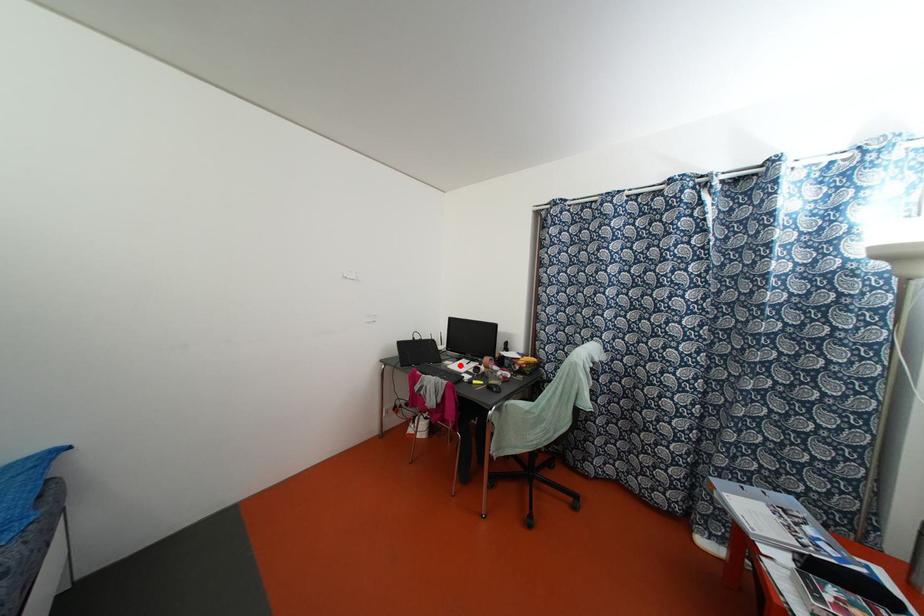
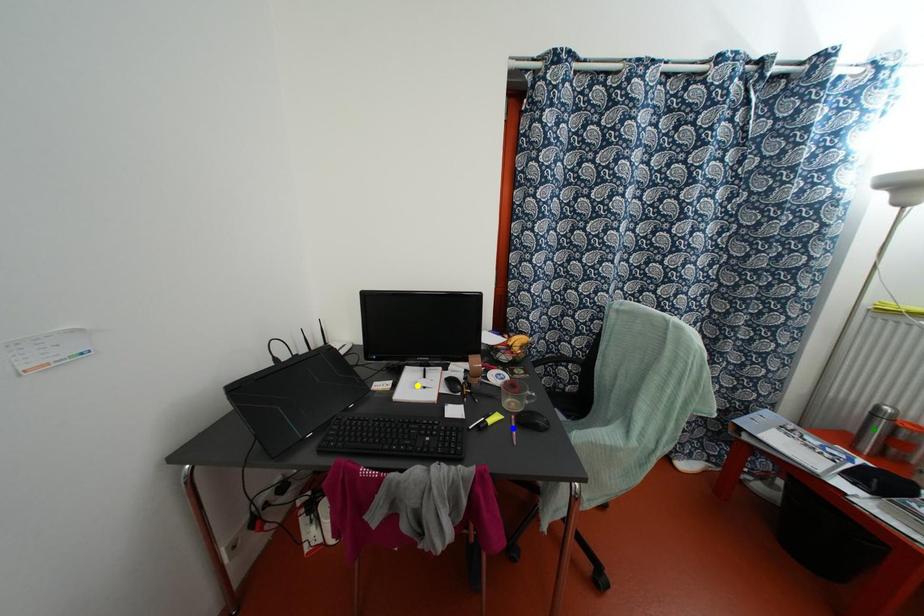
Question: I am providing you with two images of the same scene from different viewpoints. A red point is marked on the first image. You are given multiple points on the second image. Which point in image 2 represents the same 3d spot as the red point in image 1?

Choices:
 (A) yellow point
 (B) blue point
 (C) green point

Answer: (A)